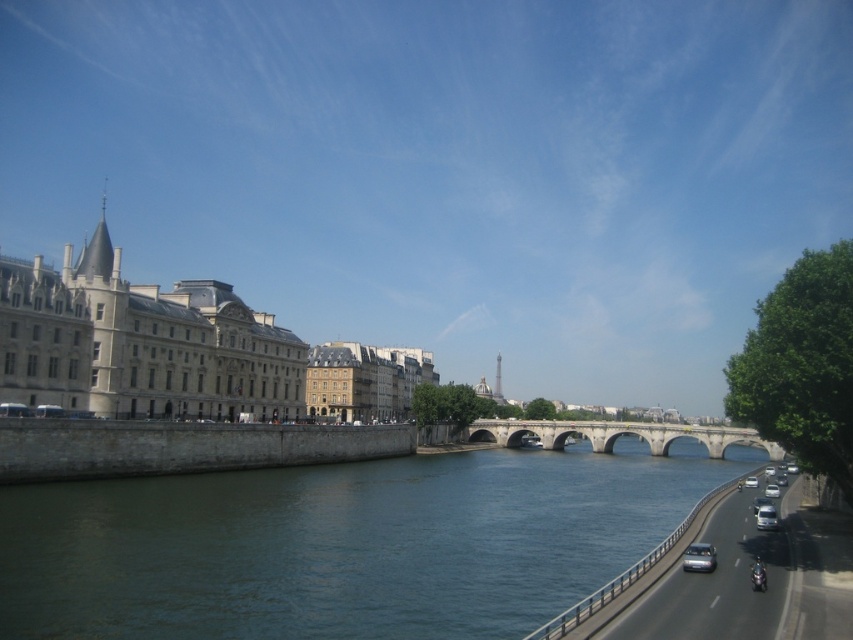
Which is in front, point (409, 461) or point (775, 460)?

Point (409, 461) is in front.

Which is in front, point (102, 573) or point (503, 422)?

Point (102, 573) is more forward.

Identify the location of greenish-blue water at center. (341, 545).

Consider the image. Is stone arch bridge at center smaller than satin silver car at right?

No, stone arch bridge at center is not smaller than satin silver car at right.

Is stone arch bridge at center positioned before satin silver car at right?

Answer: No, it is not.

Locate an element on the screen. The image size is (853, 640). stone arch bridge at center is located at coordinates (618, 435).

You are a GUI agent. You are given a task and a screenshot of the screen. Output one action in this format:
    pyautogui.click(x=<x>, y=<y>)
    Task: Click on the stone arch bridge at center
    The width and height of the screenshot is (853, 640).
    Given the screenshot: What is the action you would take?
    pyautogui.click(x=618, y=435)

Does point (514, 531) come behind point (772, 508)?

Yes, it is behind point (772, 508).

Looking at this image, is greenish-blue water at center thinner than silver metallic van at right?

No, greenish-blue water at center is not thinner than silver metallic van at right.

Between point (312, 477) and point (769, 525), which one is positioned behind?

Positioned behind is point (312, 477).

This screenshot has width=853, height=640. Find the location of `greenish-blue water at center`. greenish-blue water at center is located at coordinates (341, 545).